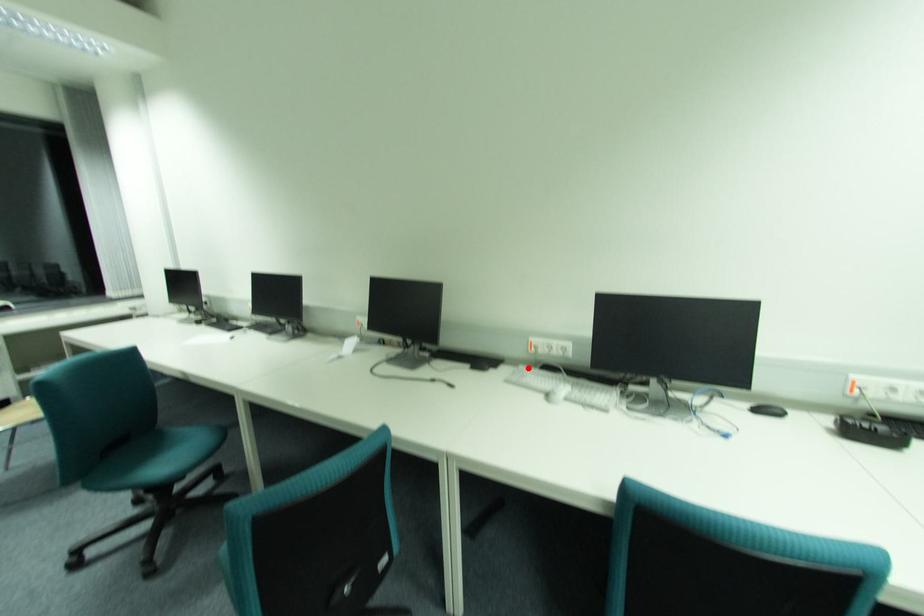
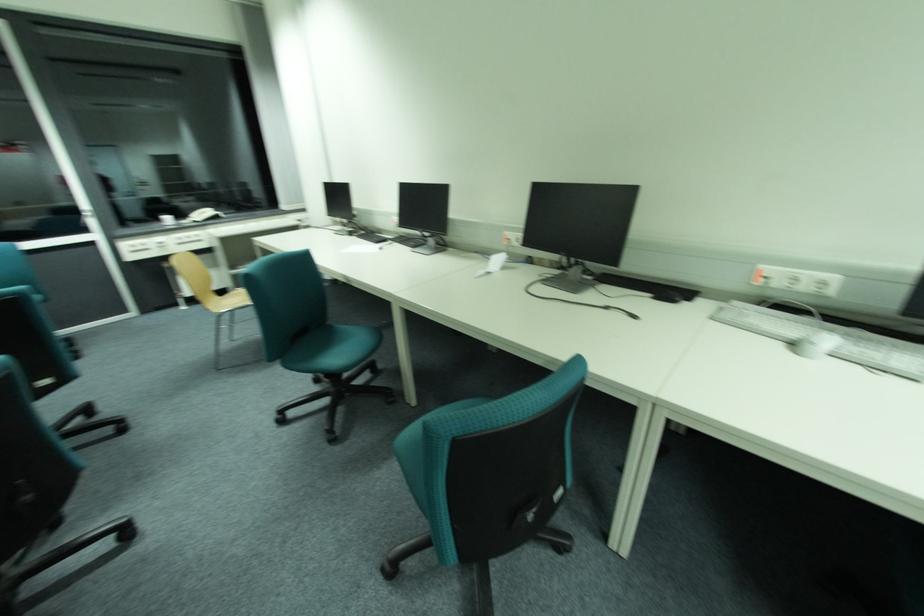
Where in the second image is the point corresponding to the highlighted location from the first image?

(743, 304)